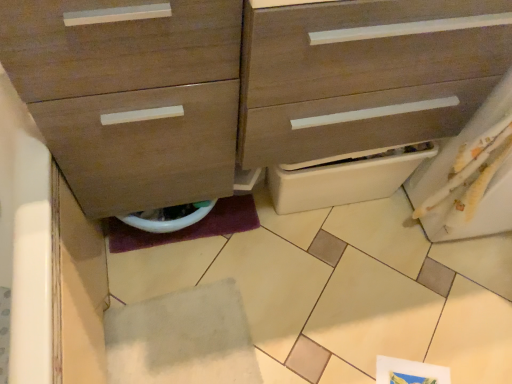
In the scene shown: What is the approximate width of matte wood chest of drawers at center?

It is 16.36 inches.

Where is `matte wood chest of drawers at center`? The image size is (512, 384). matte wood chest of drawers at center is located at coordinates (240, 85).

Find the location of a particular element. tile located below the white glossy toilet bowl at lower center (from the image's perspective) is located at coordinates (182, 338).

Would you say white felt tile at lower center is a long distance from white glossy toilet bowl at lower center?

That's not correct — white felt tile at lower center is a little close to white glossy toilet bowl at lower center.

Considering the sizes of objects white felt tile at lower center and white glossy toilet bowl at lower center in the image provided, who is shorter, white felt tile at lower center or white glossy toilet bowl at lower center?

With less height is white felt tile at lower center.

From a real-world perspective, who is located higher, white glossy toilet bowl at lower center or matte wood chest of drawers at center?

matte wood chest of drawers at center, from a real-world perspective.

Considering the positions of objects white glossy toilet bowl at lower center and matte wood chest of drawers at center in the image provided, who is more to the right, white glossy toilet bowl at lower center or matte wood chest of drawers at center?

Positioned to the right is matte wood chest of drawers at center.

Does white glossy toilet bowl at lower center have a greater height compared to matte wood chest of drawers at center?

No, white glossy toilet bowl at lower center is not taller than matte wood chest of drawers at center.

Is white glossy toilet bowl at lower center not inside matte wood chest of drawers at center?

No, most part of white glossy toilet bowl at lower center lies within matte wood chest of drawers at center.

From a real-world perspective, is white felt tile at lower center positioned over matte wood chest of drawers at center based on gravity?

No, from a real-world perspective, white felt tile at lower center is not on top of matte wood chest of drawers at center.

The image size is (512, 384). In order to click on tile below the matte wood chest of drawers at center (from the image's perspective) in this screenshot , I will do `click(182, 338)`.

Considering the positions of points (236, 303) and (137, 119), is point (236, 303) farther from camera compared to point (137, 119)?

Yes, it is behind point (137, 119).

Are white felt tile at lower center and matte wood chest of drawers at center far apart?

Actually, white felt tile at lower center and matte wood chest of drawers at center are a little close together.

Between matte wood chest of drawers at center and white glossy toilet bowl at lower center, which one has larger width?

With larger width is matte wood chest of drawers at center.

Based on the photo, between matte wood chest of drawers at center and white glossy toilet bowl at lower center, which one has more height?

Standing taller between the two is matte wood chest of drawers at center.

Is matte wood chest of drawers at center in contact with white glossy toilet bowl at lower center?

matte wood chest of drawers at center and white glossy toilet bowl at lower center are not in contact.

How distant is matte wood chest of drawers at center from white glossy toilet bowl at lower center?

matte wood chest of drawers at center is 43.39 centimeters from white glossy toilet bowl at lower center.

How different are the orientations of matte wood chest of drawers at center and white felt tile at lower center in degrees?

They differ by 90 degrees in their facing directions.

Is matte wood chest of drawers at center smaller than white felt tile at lower center?

Actually, matte wood chest of drawers at center might be larger than white felt tile at lower center.

How far apart are matte wood chest of drawers at center and white felt tile at lower center?

matte wood chest of drawers at center and white felt tile at lower center are 21.90 inches apart.

Considering the sizes of objects matte wood chest of drawers at center and white felt tile at lower center in the image provided, who is thinner, matte wood chest of drawers at center or white felt tile at lower center?

white felt tile at lower center.

Considering the sizes of objects white glossy toilet bowl at lower center and white felt tile at lower center in the image provided, who is taller, white glossy toilet bowl at lower center or white felt tile at lower center?

white glossy toilet bowl at lower center is taller.

Would you say white glossy toilet bowl at lower center is a long distance from white felt tile at lower center?

No, white glossy toilet bowl at lower center is in close proximity to white felt tile at lower center.

Does point (163, 211) lie in front of point (124, 325)?

No, (163, 211) is behind (124, 325).

Locate an element on the screen. Image resolution: width=512 pixels, height=384 pixels. tile in front of the white glossy toilet bowl at lower center is located at coordinates (182, 338).

At what (x,y) coordinates should I click in order to perform the action: click on chest of drawers on the right of white glossy toilet bowl at lower center. Please return your answer as a coordinate pair (x, y). Image resolution: width=512 pixels, height=384 pixels. Looking at the image, I should click on (240, 85).

From the image, which object appears to be farther from white glossy toilet bowl at lower center, white felt tile at lower center or matte wood chest of drawers at center?

The object further to white glossy toilet bowl at lower center is matte wood chest of drawers at center.

Which object lies further to the anchor point matte wood chest of drawers at center, white felt tile at lower center or white glossy toilet bowl at lower center?

white felt tile at lower center is positioned further to the anchor matte wood chest of drawers at center.

Looking at the image, which one is located further to white felt tile at lower center, white glossy toilet bowl at lower center or matte wood chest of drawers at center?

A: matte wood chest of drawers at center lies further to white felt tile at lower center than the other object.

Based on their spatial positions, is matte wood chest of drawers at center or white glossy toilet bowl at lower center further from white felt tile at lower center?

matte wood chest of drawers at center is further to white felt tile at lower center.

When comparing their distances from matte wood chest of drawers at center, does white glossy toilet bowl at lower center or white felt tile at lower center seem further?

white felt tile at lower center is positioned further to the anchor matte wood chest of drawers at center.

Which object lies nearer to the anchor point white glossy toilet bowl at lower center, matte wood chest of drawers at center or white felt tile at lower center?

Based on the image, white felt tile at lower center appears to be nearer to white glossy toilet bowl at lower center.

This screenshot has height=384, width=512. Find the location of `toilet bowl that lies between matte wood chest of drawers at center and white felt tile at lower center from top to bottom`. toilet bowl that lies between matte wood chest of drawers at center and white felt tile at lower center from top to bottom is located at coordinates (169, 217).